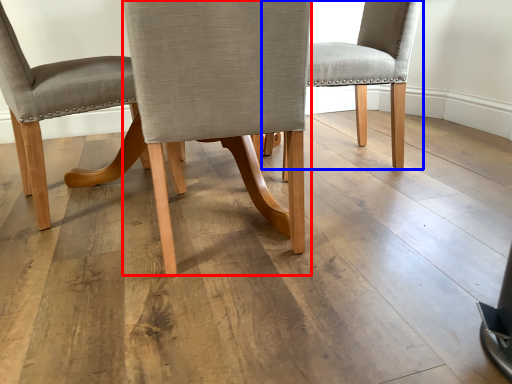
Question: Among these objects, which one is farthest to the camera, chair (highlighted by a red box) or chair (highlighted by a blue box)?

Choices:
 (A) chair
 (B) chair

Answer: (B)